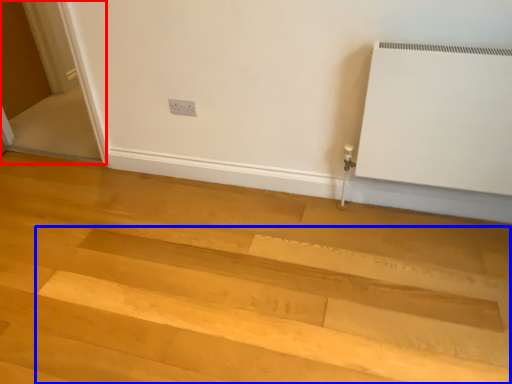
Question: Which point is closer to the camera, screen door (highlighted by a red box) or stairwell (highlighted by a blue box)?

Choices:
 (A) screen door
 (B) stairwell

Answer: (B)